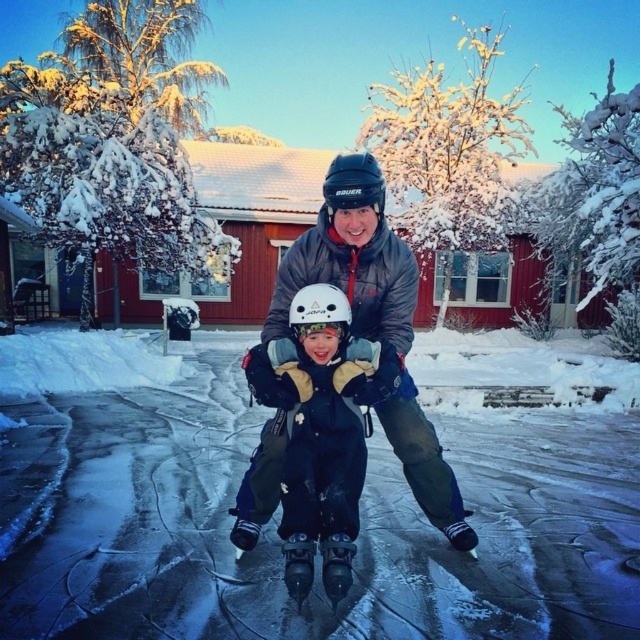
Where is the black matte helmet at center located in the image?

The black matte helmet at center is located at point coordinates of (353, 184).

Based on the scene, can you determine which object is shorter between the white fluffy snow at center and the dark blue fabric jacket at center?

The white fluffy snow at center is shorter than the dark blue fabric jacket at center.

You are observing a winter scene where a child and an adult are ice skating. The adult is wearing a matte gray jacket at center, and the child has a white matte helmet at center. Based on the scene, which object is taller?

The matte gray jacket at center is taller than the white matte helmet at center.